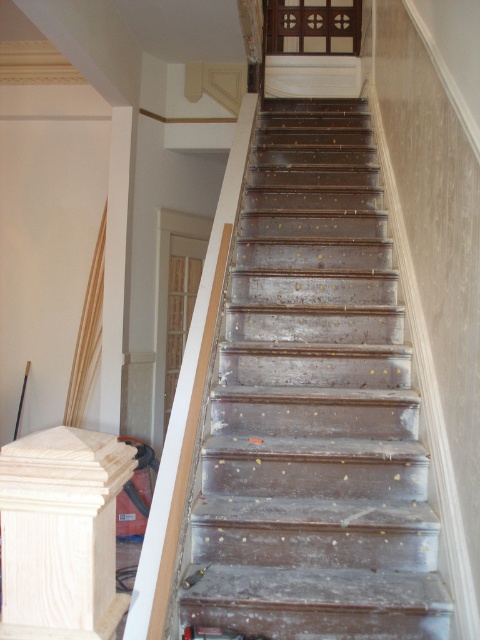
Question: Does wooden stairs at center appear over unfinished wood post at left?

Choices:
 (A) no
 (B) yes

Answer: (B)

Question: Where is wooden stairs at center located in relation to unfinished wood post at left in the image?

Choices:
 (A) above
 (B) below

Answer: (A)

Question: Can you confirm if wooden stairs at center is positioned to the right of unfinished wood post at left?

Choices:
 (A) no
 (B) yes

Answer: (B)

Question: Among these points, which one is nearest to the camera?

Choices:
 (A) (249, 432)
 (B) (84, 490)

Answer: (B)